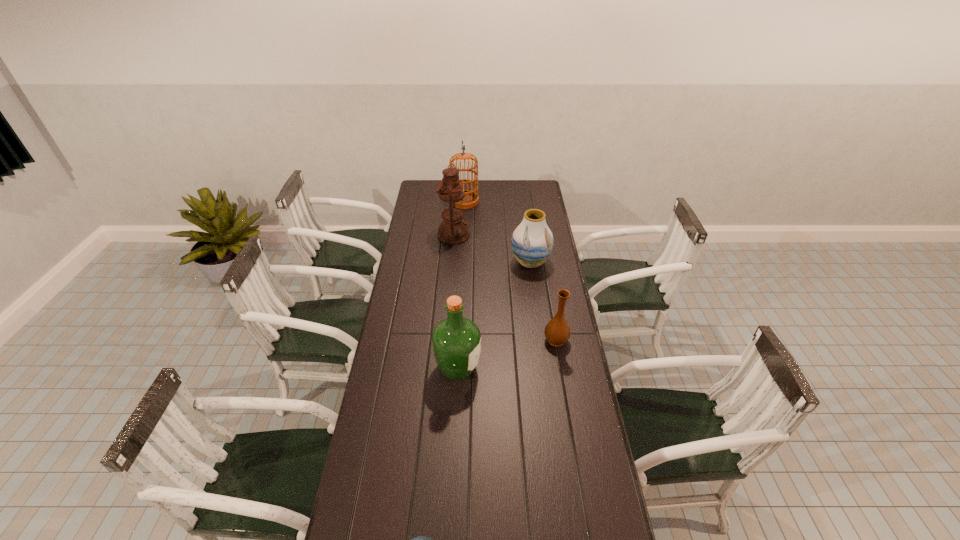
This screenshot has height=540, width=960. What are the coordinates of `the farthest object` in the screenshot? It's located at (471, 197).

Identify the location of the second farthest object. (453, 230).

Locate an element on the screen. liquor is located at coordinates (456, 340).

Locate an element on the screen. The width and height of the screenshot is (960, 540). the fourth nearest object is located at coordinates (532, 241).

What are the coordinates of `the second farthest vase` in the screenshot? It's located at pos(557,331).

Identify the location of vacant space situated on the right of the farthest object. (495, 201).

The width and height of the screenshot is (960, 540). Identify the location of vacant area situated 0.170m on the left of the fifth nearest object. click(406, 235).

At what (x,y) coordinates should I click in order to perform the action: click on free space located on the front-facing side of the liquor. Please return your answer as a coordinate pair (x, y). Image resolution: width=960 pixels, height=540 pixels. Looking at the image, I should click on (507, 367).

At what (x,y) coordinates should I click in order to perform the action: click on free space located 0.140m on the back of the farthest vase. Please return your answer as a coordinate pair (x, y). Image resolution: width=960 pixels, height=540 pixels. Looking at the image, I should click on (527, 234).

Locate an element on the screen. This screenshot has height=540, width=960. free point located on the back of the second farthest vase is located at coordinates (546, 280).